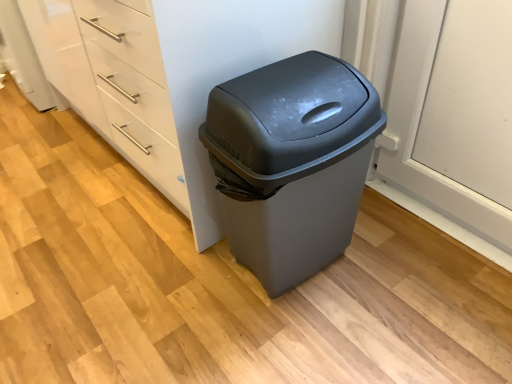
Find the location of a particular element. Image resolution: width=512 pixels, height=384 pixels. vacant area situated below matte gray plastic trash can at center (from a real-world perspective) is located at coordinates (302, 282).